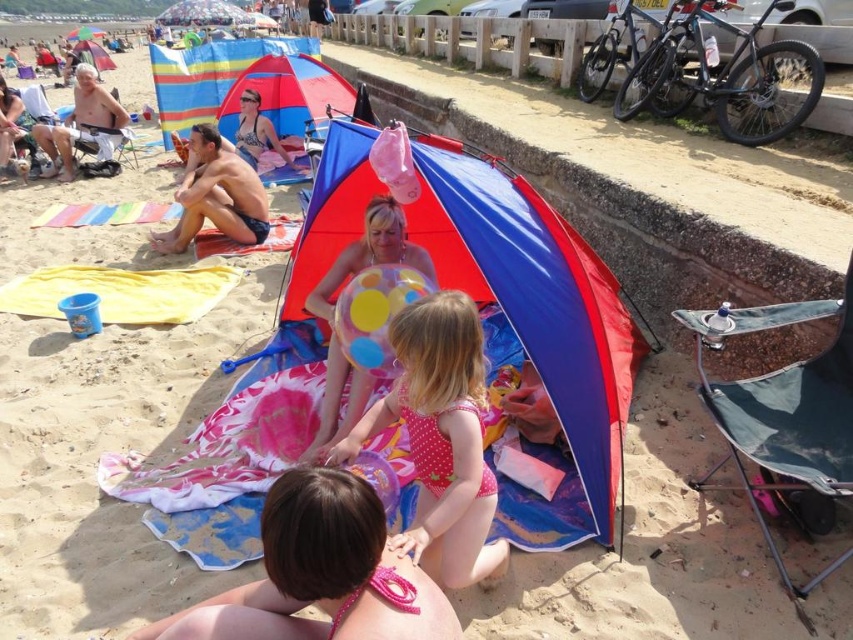
Question: Based on their relative distances, which object is nearer to the shiny silver helmet at upper left?

Choices:
 (A) tan skin man at center
 (B) pink fabric bikini at lower center

Answer: (A)

Question: Considering the relative positions of tan skin man at center and shiny silver helmet at upper left in the image provided, where is tan skin man at center located with respect to shiny silver helmet at upper left?

Choices:
 (A) left
 (B) right

Answer: (B)

Question: Which object appears farthest from the camera in this image?

Choices:
 (A) matte plastic umbrella at center
 (B) pink fabric bikini at lower center

Answer: (A)

Question: Which point is closer to the camera?

Choices:
 (A) shiny silver helmet at upper left
 (B) matte plastic umbrella at center
 (C) pink fabric bikini at lower center
 (D) tan skin man at center

Answer: (C)

Question: In this image, where is pink polka dot swimsuit at center located relative to tan skin man at center?

Choices:
 (A) above
 (B) below

Answer: (B)

Question: Can you confirm if tan skin man at center is positioned to the left of shiny silver helmet at upper left?

Choices:
 (A) no
 (B) yes

Answer: (A)